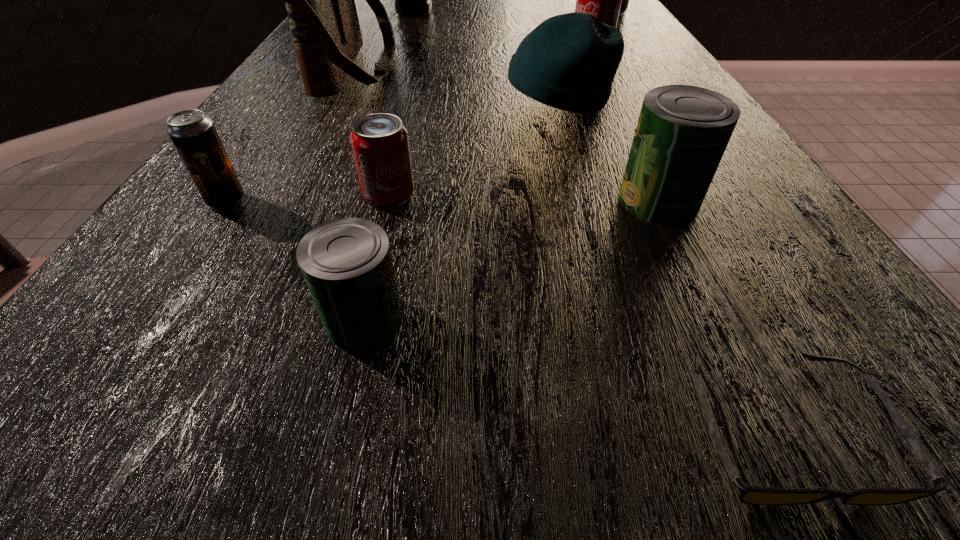
Identify the location of beer can present at the left edge. Image resolution: width=960 pixels, height=540 pixels. (194, 135).

Image resolution: width=960 pixels, height=540 pixels. I want to click on sunglasses at the right edge, so click(x=749, y=494).

You are a GUI agent. You are given a task and a screenshot of the screen. Output one action in this format:
    pyautogui.click(x=<x>, y=<y>)
    Task: Click on the object present at the far right corner
    The width and height of the screenshot is (960, 540).
    Given the screenshot: What is the action you would take?
    pyautogui.click(x=625, y=0)

The height and width of the screenshot is (540, 960). I want to click on object that is positioned at the near right corner, so click(x=749, y=494).

In the image, there is a desktop. Identify the location of vacant space at the far edge. (464, 19).

In the image, there is a desktop. At what (x,y) coordinates should I click in order to perform the action: click on vacant space at the near edge. Please return your answer as a coordinate pair (x, y). The width and height of the screenshot is (960, 540). Looking at the image, I should click on (228, 437).

The width and height of the screenshot is (960, 540). In order to click on free space at the left edge of the desktop in this screenshot , I will do `click(122, 274)`.

Find the location of `blank space at the right edge`. blank space at the right edge is located at coordinates (630, 23).

I want to click on unoccupied area between the farthest can and the leftmost red can, so click(496, 103).

Where is `free area in between the second smallest red can and the liquor`? free area in between the second smallest red can and the liquor is located at coordinates (503, 28).